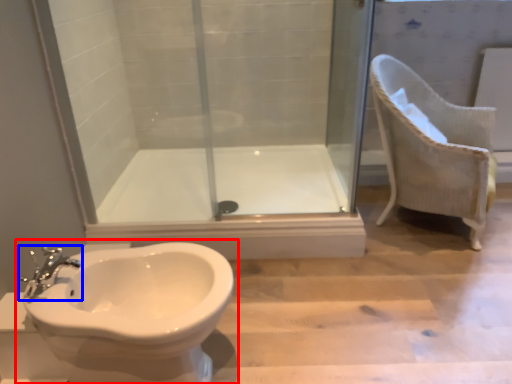
Question: Which point is further to the camera, toilet (highlighted by a red box) or tap (highlighted by a blue box)?

Choices:
 (A) toilet
 (B) tap

Answer: (B)